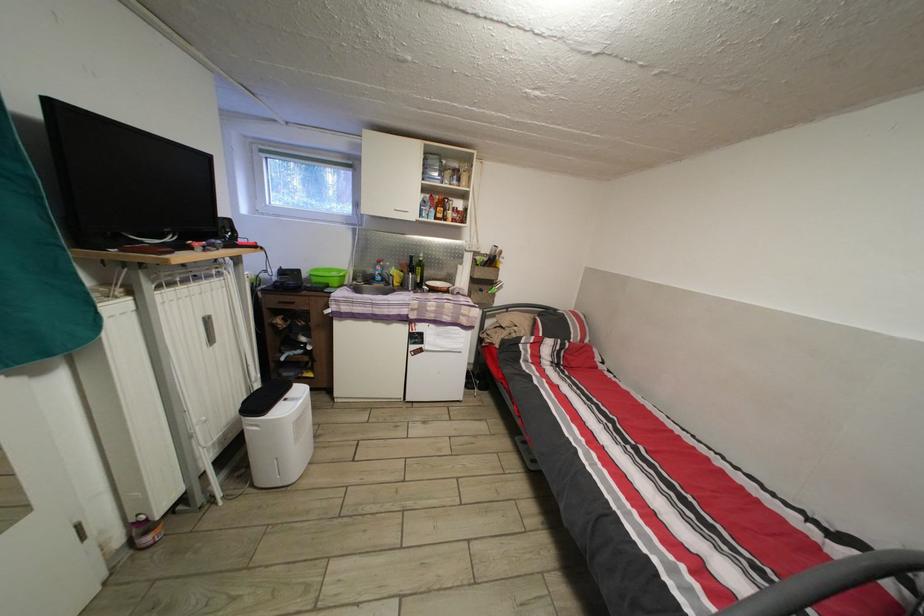
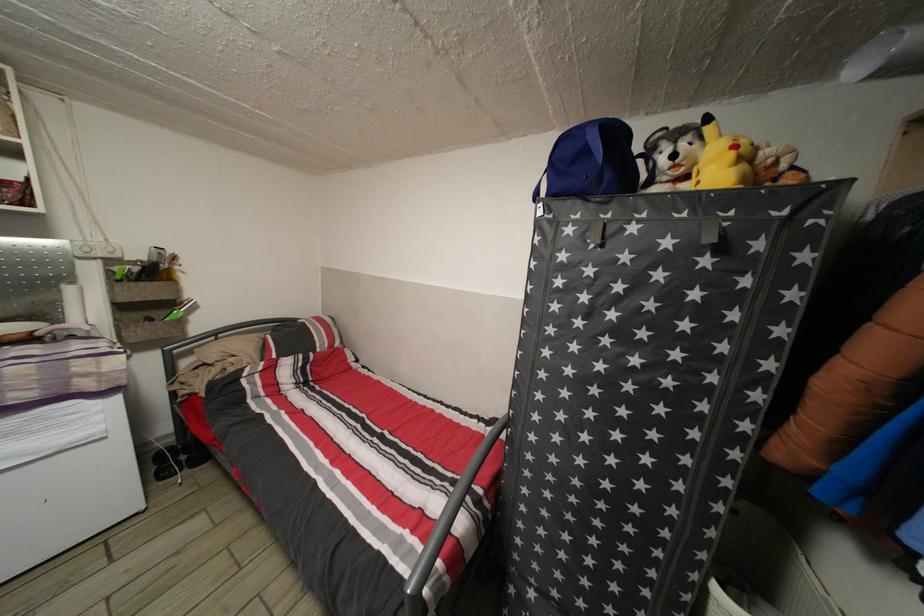
Find the pixel in the second image that matches (x=483, y=397) in the first image.

(192, 477)